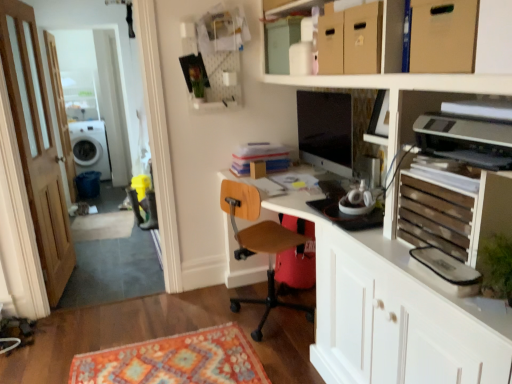
Question: From a real-world perspective, is brown wooden screen door at left under matte black monitor at center?

Choices:
 (A) no
 (B) yes

Answer: (B)

Question: Is brown wooden screen door at left turned away from matte black monitor at center?

Choices:
 (A) yes
 (B) no

Answer: (B)

Question: Are brown wooden screen door at left and matte black monitor at center far apart?

Choices:
 (A) yes
 (B) no

Answer: (A)

Question: From a real-world perspective, is brown wooden screen door at left located higher than matte black monitor at center?

Choices:
 (A) yes
 (B) no

Answer: (B)

Question: Is brown wooden screen door at left bigger than matte black monitor at center?

Choices:
 (A) no
 (B) yes

Answer: (B)

Question: Is brown wooden screen door at left placed right next to matte black monitor at center?

Choices:
 (A) yes
 (B) no

Answer: (B)

Question: Can we say wooden door at left lies outside wooden slats at right?

Choices:
 (A) yes
 (B) no

Answer: (A)

Question: From the image's perspective, is wooden door at left below wooden slats at right?

Choices:
 (A) yes
 (B) no

Answer: (B)

Question: Can you confirm if wooden door at left is positioned to the left of wooden slats at right?

Choices:
 (A) yes
 (B) no

Answer: (A)

Question: Is wooden door at left thinner than wooden slats at right?

Choices:
 (A) no
 (B) yes

Answer: (B)

Question: Can you confirm if wooden door at left is wider than wooden slats at right?

Choices:
 (A) no
 (B) yes

Answer: (A)

Question: Does wooden door at left have a greater height compared to wooden slats at right?

Choices:
 (A) no
 (B) yes

Answer: (B)

Question: From a real-world perspective, is cardboard box at upper right positioned over wooden slats at right based on gravity?

Choices:
 (A) no
 (B) yes

Answer: (B)